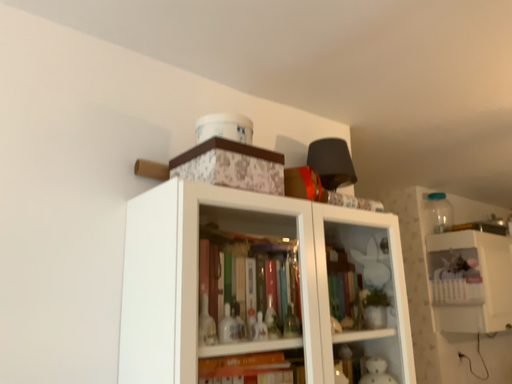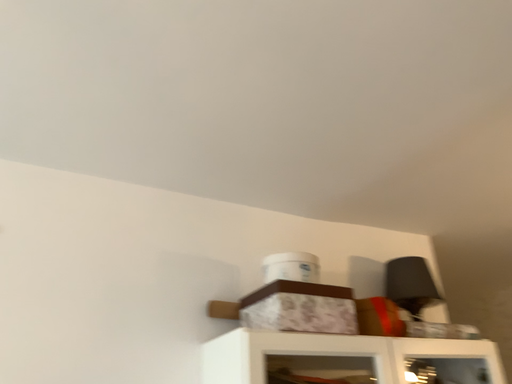
Question: How did the camera likely rotate when shooting the video?

Choices:
 (A) rotated left
 (B) rotated right

Answer: (A)